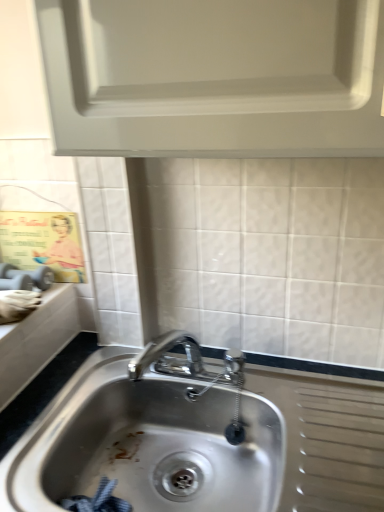
Where is `stainless steel sink at center`? The width and height of the screenshot is (384, 512). stainless steel sink at center is located at coordinates (147, 444).

What do you see at coordinates (147, 444) in the screenshot? I see `stainless steel sink at center` at bounding box center [147, 444].

Locate an element on the screen. stainless steel sink at center is located at coordinates (147, 444).